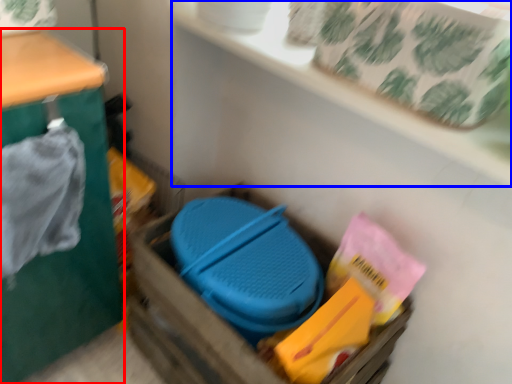
Question: Which of the following is the farthest to the observer, furniture (highlighted by a red box) or shelf (highlighted by a blue box)?

Choices:
 (A) furniture
 (B) shelf

Answer: (B)